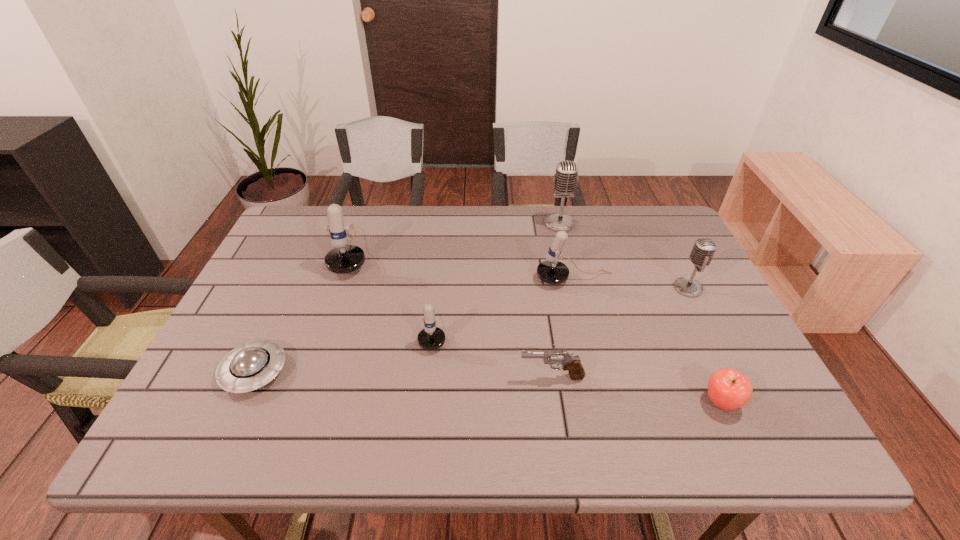
This screenshot has width=960, height=540. I want to click on the bigger gray microphone, so click(x=565, y=181).

The width and height of the screenshot is (960, 540). I want to click on the farther gray microphone, so click(x=565, y=181).

Locate an element on the screen. the second object from left to right is located at coordinates (344, 258).

I want to click on the leftmost microphone, so click(344, 258).

Locate an element on the screen. the second biggest white microphone is located at coordinates (551, 271).

What are the coordinates of `the right gray microphone` in the screenshot? It's located at (703, 250).

You are a GUI agent. You are given a task and a screenshot of the screen. Output one action in this format:
    pyautogui.click(x=<x>, y=<y>)
    Task: Click on the rightmost microphone
    The width and height of the screenshot is (960, 540).
    Given the screenshot: What is the action you would take?
    pyautogui.click(x=703, y=250)

This screenshot has height=540, width=960. In order to click on the second white microphone from right to left in this screenshot , I will do `click(431, 337)`.

Identify the location of the sixth object from right to left. The width and height of the screenshot is (960, 540). (431, 337).

The height and width of the screenshot is (540, 960). I want to click on apple, so click(x=728, y=389).